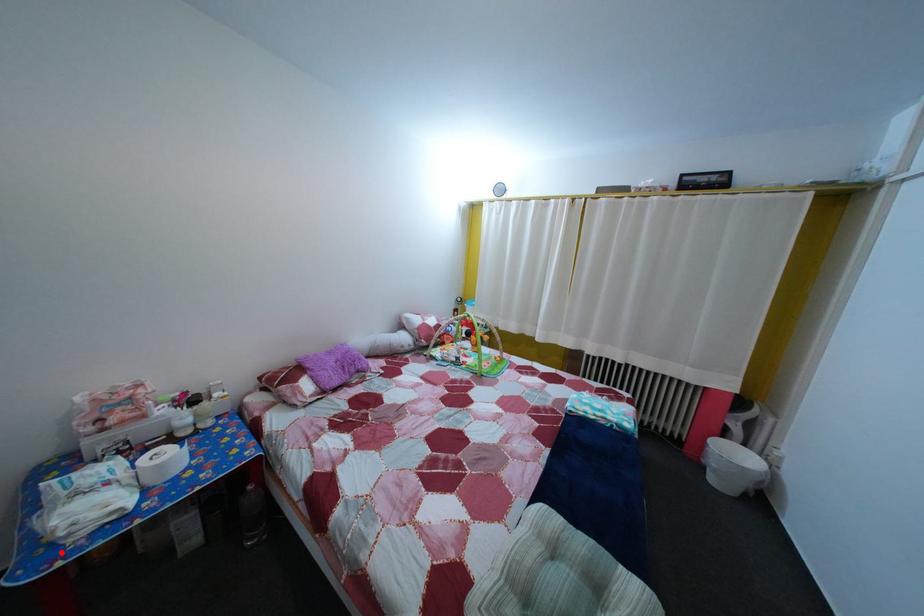
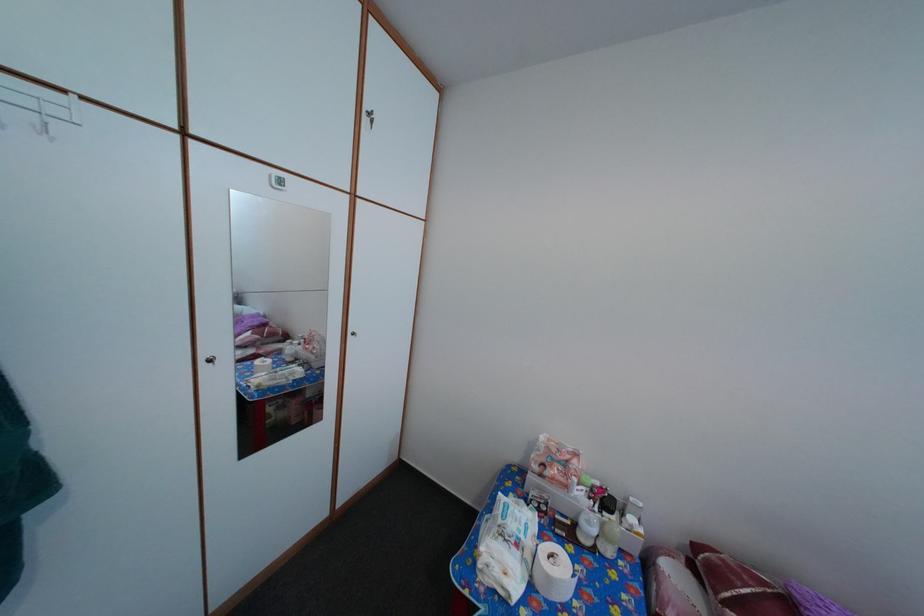
Where in the second image is the point corresponding to the highlighted location from the first image?

(484, 572)